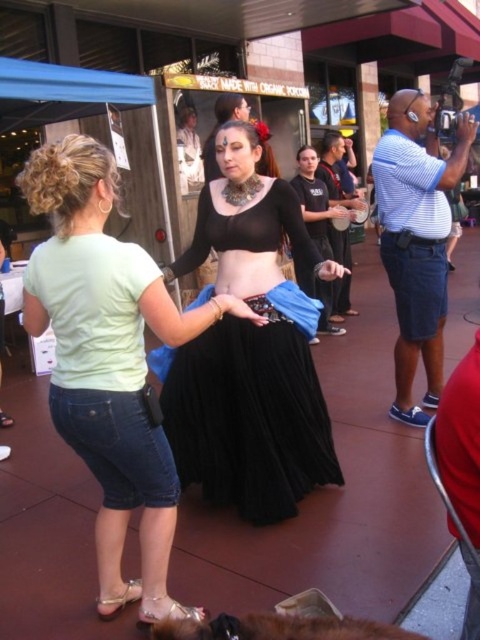
Question: Which of the following is the farthest from the observer?

Choices:
 (A) black pleated skirt at center
 (B) black satin skirt at center

Answer: (A)

Question: Which object is farther from the camera taking this photo?

Choices:
 (A) black satin skirt at center
 (B) black pleated skirt at center

Answer: (B)

Question: Can you confirm if black satin skirt at center is positioned below black pleated skirt at center?

Choices:
 (A) no
 (B) yes

Answer: (B)

Question: Which point is farther to the camera?

Choices:
 (A) (197, 614)
 (B) (179, 401)

Answer: (B)

Question: Is black satin skirt at center thinner than black pleated skirt at center?

Choices:
 (A) yes
 (B) no

Answer: (A)

Question: Is black satin skirt at center to the left of black pleated skirt at center from the viewer's perspective?

Choices:
 (A) no
 (B) yes

Answer: (B)